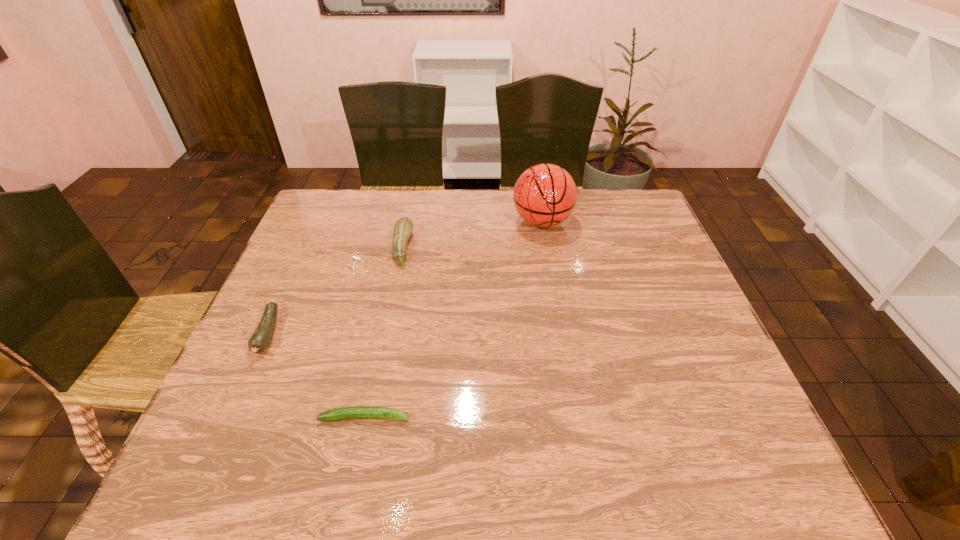
What are the coordinates of `vacant space that satisfies the following two spatial constraints: 1. at the stem end of the farthest zucchini; 2. at the blossom end of the leftmost zucchini` in the screenshot? It's located at (385, 333).